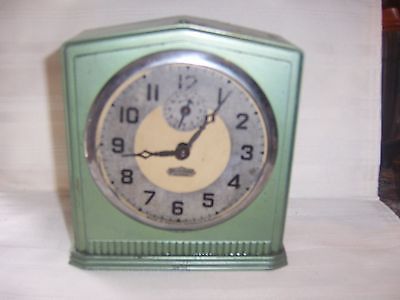
Locate an element on the screen. Image resolution: width=400 pixels, height=300 pixels. top of clock is located at coordinates (191, 17).